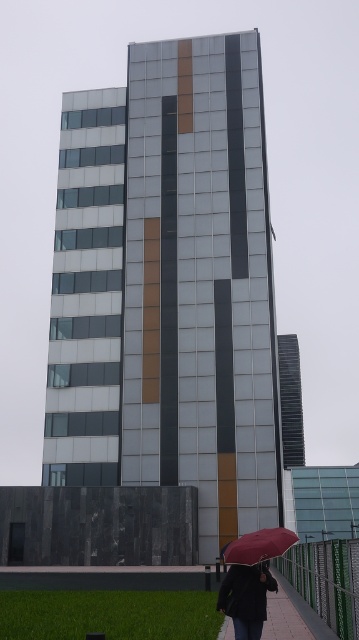
In the scene shown: Is dark gray fabric jacket at lower center positioned in front of matte black umbrella at lower center?

Yes, dark gray fabric jacket at lower center is in front of matte black umbrella at lower center.

Between dark gray fabric jacket at lower center and matte black umbrella at lower center, which one is positioned higher?

dark gray fabric jacket at lower center is higher up.

Who is more distant from viewer, [260,602] or [286,541]?

The point [286,541] is more distant.

In order to click on dark gray fabric jacket at lower center in this screenshot , I will do `click(245, 596)`.